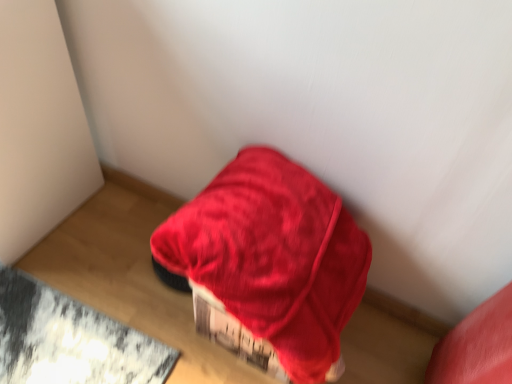
The height and width of the screenshot is (384, 512). What do you see at coordinates (272, 258) in the screenshot?
I see `velvety red towel at lower center` at bounding box center [272, 258].

You are a GUI agent. You are given a task and a screenshot of the screen. Output one action in this format:
    pyautogui.click(x=<x>, y=<y>)
    Task: Click on the velvety red towel at lower center
    
    Given the screenshot: What is the action you would take?
    pyautogui.click(x=272, y=258)

This screenshot has width=512, height=384. Find the location of `velvety red towel at lower center`. velvety red towel at lower center is located at coordinates (272, 258).